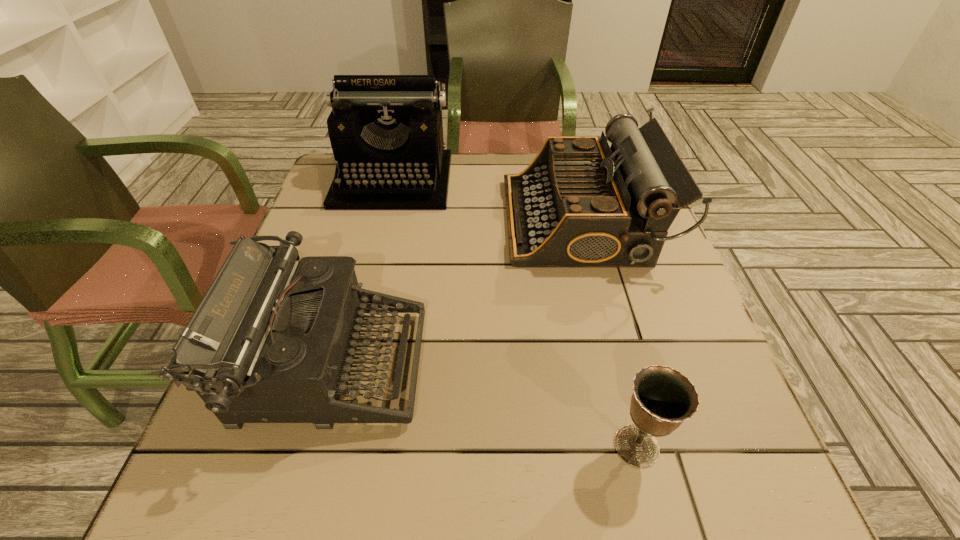
This screenshot has height=540, width=960. In the image, there is a desktop. Find the location of `vacant space at the left edge`. vacant space at the left edge is located at coordinates (354, 249).

You are a GUI agent. You are given a task and a screenshot of the screen. Output one action in this format:
    pyautogui.click(x=<x>, y=<y>)
    Task: Click on the vacant space at the right edge of the desktop
    This screenshot has width=960, height=540.
    Given the screenshot: What is the action you would take?
    pyautogui.click(x=683, y=299)

The height and width of the screenshot is (540, 960). In the image, there is a desktop. Identify the location of vacant space at the far left corner. (320, 193).

In the image, there is a desktop. Identify the location of vacant space at the near left corner. click(276, 460).

Image resolution: width=960 pixels, height=540 pixels. What are the coordinates of `vacant point at the near right corner` in the screenshot? It's located at (710, 457).

I want to click on vacant space that is in between the rightmost typewriter and the nearest typewriter, so click(x=455, y=293).

Locate an element on the screen. The image size is (960, 540). blank region between the rightmost typewriter and the shortest object is located at coordinates (609, 333).

In order to click on unoccupied position between the nearest typewriter and the chalice in this screenshot , I will do `click(483, 406)`.

The height and width of the screenshot is (540, 960). Find the location of `vacant area that lies between the tallest typewriter and the shortest object`. vacant area that lies between the tallest typewriter and the shortest object is located at coordinates (515, 313).

Find the location of a particular element. The width and height of the screenshot is (960, 540). vacant region between the chalice and the tallest typewriter is located at coordinates (515, 313).